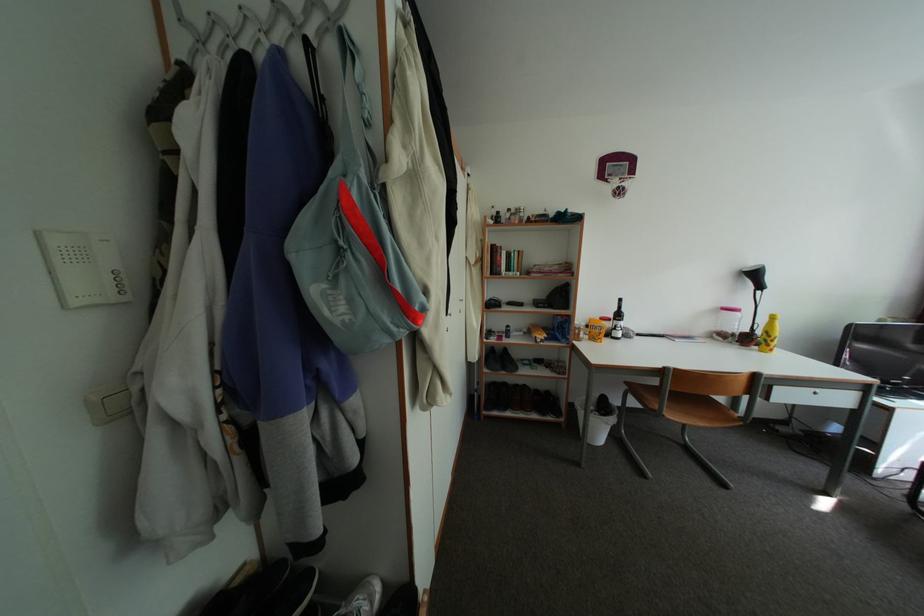
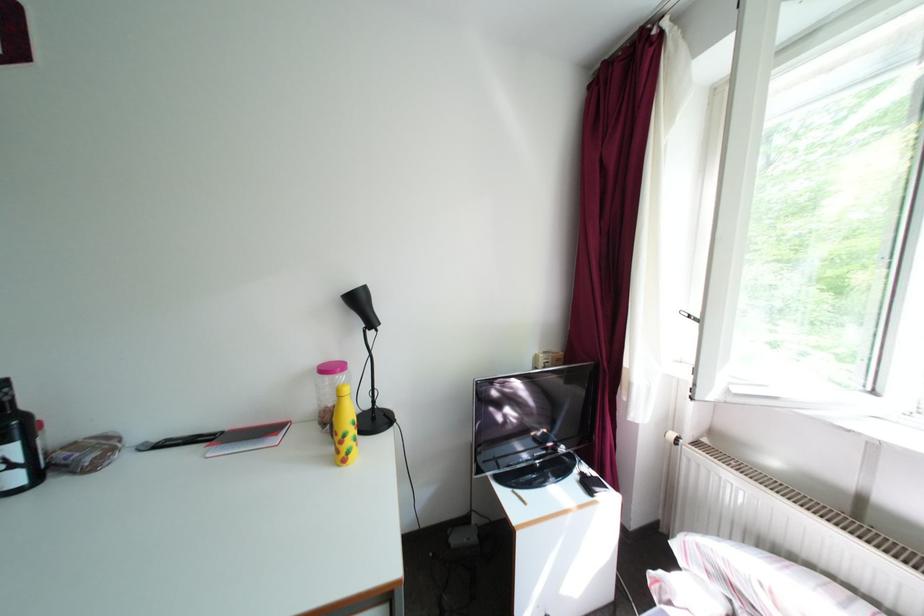
Question: Which direction would the cameraman need to move to produce the second image? Reply with the corresponding letter.

Choices:
 (A) Left
 (B) Right
 (C) Forward
 (D) Backward

Answer: (B)